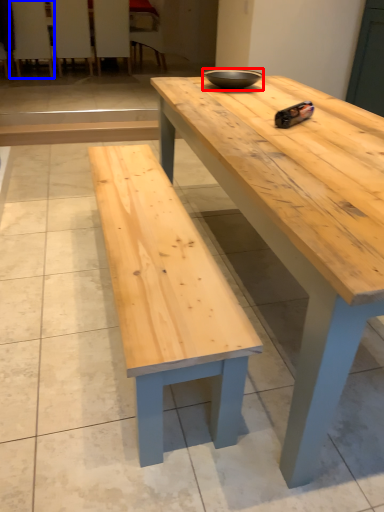
Question: Which object is further to the camera taking this photo, bowl (highlighted by a red box) or chair (highlighted by a blue box)?

Choices:
 (A) bowl
 (B) chair

Answer: (B)